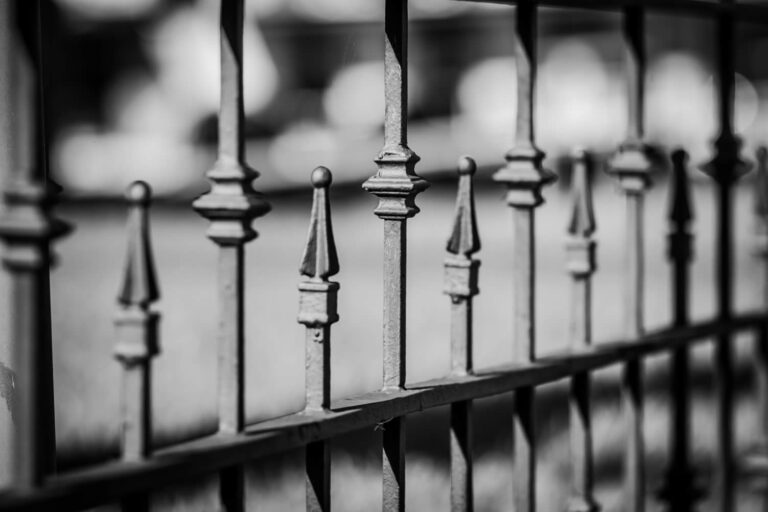
Identify the location of rod. tap(140, 420).